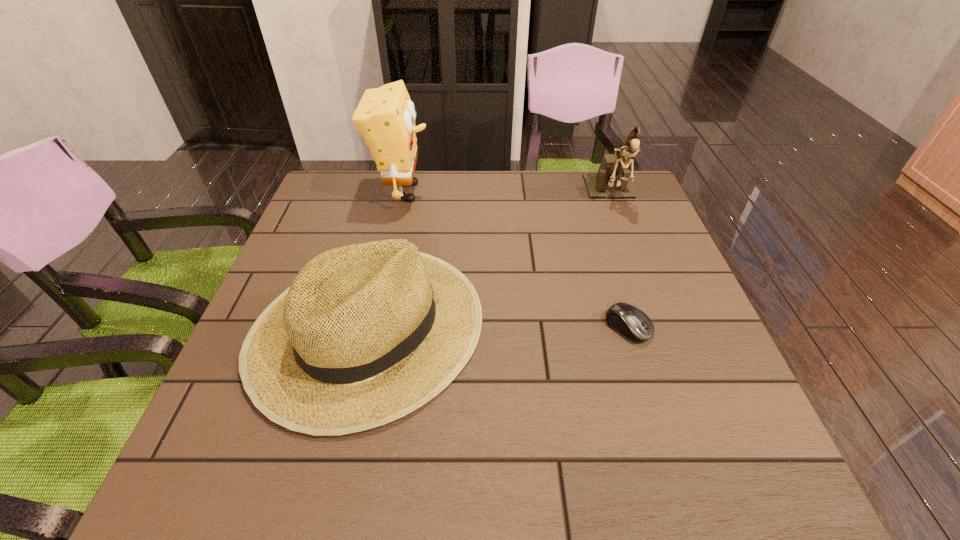
This screenshot has height=540, width=960. Find the location of `free location at the near left corner`. free location at the near left corner is located at coordinates (191, 461).

Where is `free space at the far right corner`? This screenshot has height=540, width=960. free space at the far right corner is located at coordinates (612, 213).

Locate an element on the screen. The image size is (960, 540). free space at the near right corner of the desktop is located at coordinates (725, 476).

What are the coordinates of `free area in between the figurine and the third tallest object` in the screenshot? It's located at (490, 260).

Where is `vacant space that's between the figurine and the sponge`? This screenshot has width=960, height=540. vacant space that's between the figurine and the sponge is located at coordinates (507, 193).

What are the coordinates of `vacant space that is in between the second shortest object and the figurine` in the screenshot? It's located at (490, 260).

Locate an element on the screen. The image size is (960, 540). free space between the mouse and the third tallest object is located at coordinates (498, 327).

The width and height of the screenshot is (960, 540). I want to click on free space between the figurine and the sunhat, so click(490, 260).

Find the location of a particular element. vacant space that's between the figurine and the sponge is located at coordinates (507, 193).

At what (x,y) coordinates should I click in order to perform the action: click on free space between the sunhat and the figurine. Please return your answer as a coordinate pair (x, y). The image size is (960, 540). Looking at the image, I should click on (490, 260).